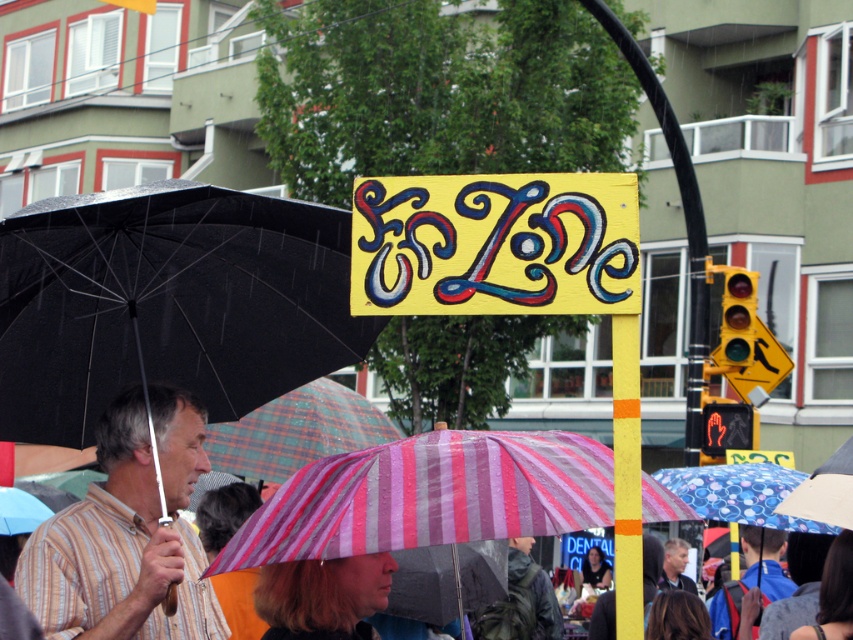
Question: Where is pink striped fabric umbrella at center located in relation to blonde hair at center in the image?

Choices:
 (A) above
 (B) below

Answer: (A)

Question: Does black matte umbrella at upper left have a larger size compared to striped shirt at center?

Choices:
 (A) no
 (B) yes

Answer: (B)

Question: Which point is farther from the camera taking this photo?

Choices:
 (A) (741, 464)
 (B) (349, 534)
 (C) (97, 515)

Answer: (A)

Question: Among these objects, which one is nearest to the camera?

Choices:
 (A) blue dotted fabric umbrella at lower right
 (B) striped shirt at center

Answer: (B)

Question: Which point is farther from the camera taking this photo?

Choices:
 (A) (132, 556)
 (B) (329, 627)
 (C) (711, 467)

Answer: (C)

Question: Is black matte umbrella at upper left to the right of striped shirt at center from the viewer's perspective?

Choices:
 (A) yes
 (B) no

Answer: (A)